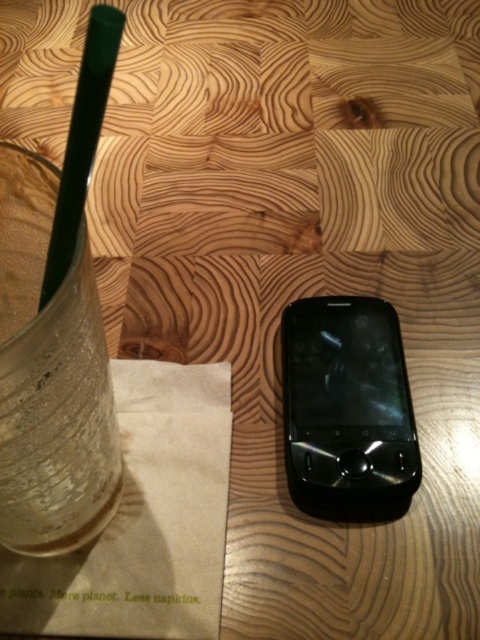
From the picture: Which of these two, clear glass at left or black glossy smartphone at center, stands taller?

clear glass at left

Locate an element on the screen. clear glass at left is located at coordinates (49, 378).

Based on the photo, between clear glass at left and green plastic straw at upper left, which one appears on the left side from the viewer's perspective?

From the viewer's perspective, clear glass at left appears more on the left side.

Image resolution: width=480 pixels, height=640 pixels. What do you see at coordinates (49, 378) in the screenshot?
I see `clear glass at left` at bounding box center [49, 378].

I want to click on clear glass at left, so click(x=49, y=378).

Is black glossy smartphone at center behind green plastic straw at upper left?

Yes, black glossy smartphone at center is behind green plastic straw at upper left.

Which of these two, black glossy smartphone at center or green plastic straw at upper left, stands shorter?

green plastic straw at upper left is shorter.

Where is `black glossy smartphone at center`? black glossy smartphone at center is located at coordinates (347, 406).

Where is `black glossy smartphone at center`? The width and height of the screenshot is (480, 640). black glossy smartphone at center is located at coordinates (347, 406).